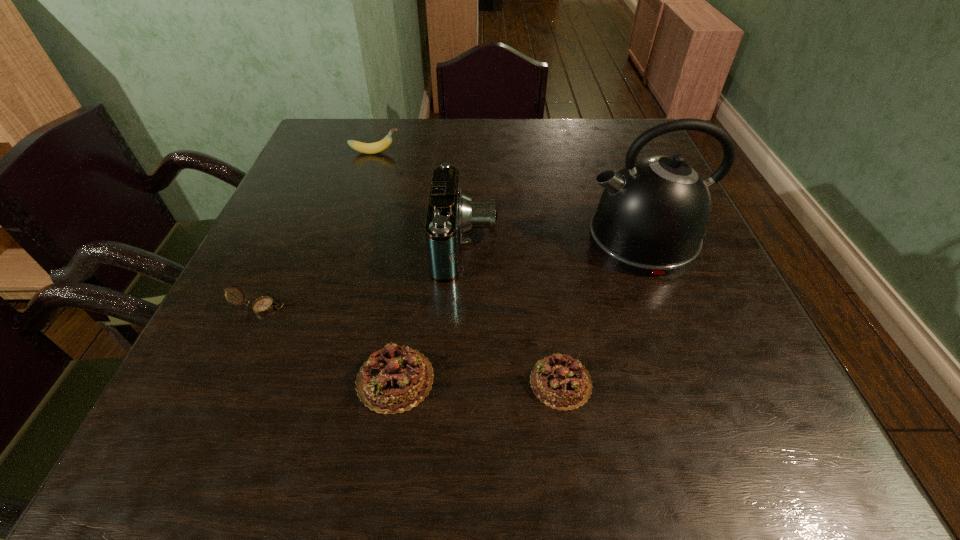
You are a GUI agent. You are given a task and a screenshot of the screen. Output one action in this format:
    pyautogui.click(x=<x>, y=<y>)
    Task: Click on the compass that is at the left edge
    This screenshot has width=960, height=540.
    Given the screenshot: What is the action you would take?
    pyautogui.click(x=263, y=305)

The width and height of the screenshot is (960, 540). I want to click on object positioned at the right edge, so click(652, 215).

Identify the location of object that is at the far left corner. Image resolution: width=960 pixels, height=540 pixels. (367, 148).

What are the coordinates of `vacant space at the far edge` in the screenshot? It's located at (468, 140).

Locate an element on the screen. free space at the near edge is located at coordinates (641, 400).

At what (x,y) coordinates should I click in order to perform the action: click on vacant space at the left edge of the desktop. Please return your answer as a coordinate pair (x, y). Image resolution: width=960 pixels, height=540 pixels. Looking at the image, I should click on (276, 206).

The height and width of the screenshot is (540, 960). I want to click on free space at the right edge of the desktop, so click(x=748, y=327).

In the image, there is a desktop. Identify the location of vacant space at the near left corner. This screenshot has height=540, width=960. (272, 371).

In order to click on vacant area at the far right corner in this screenshot , I will do `click(635, 140)`.

The image size is (960, 540). What are the coordinates of `free area in between the rightmost object and the fifth object from right to left` in the screenshot? It's located at (509, 196).